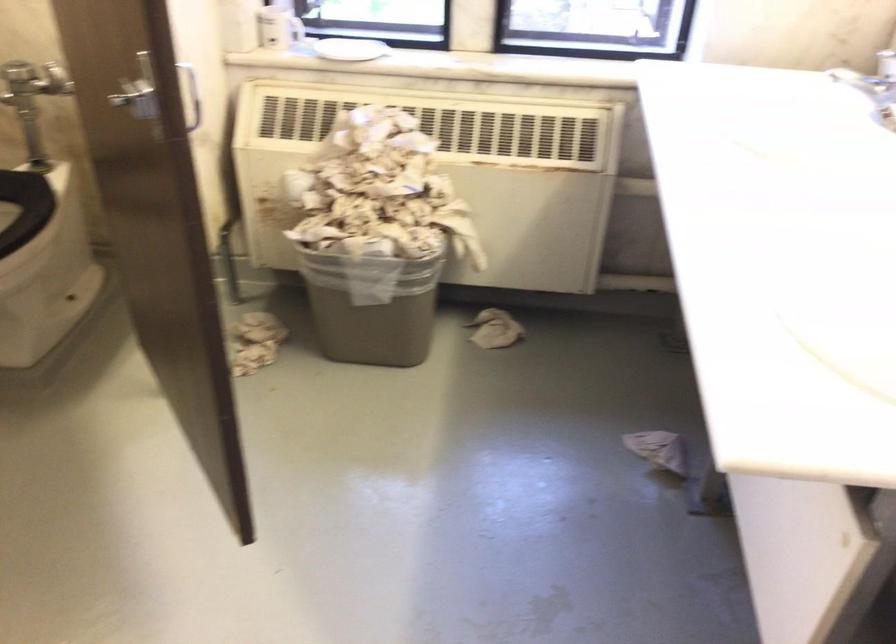
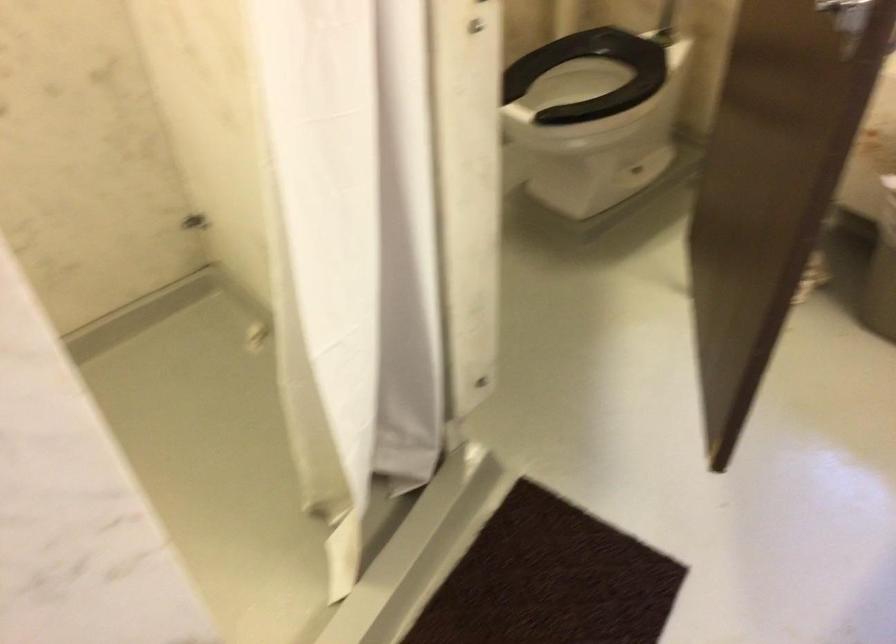
Question: I am providing you with two images of the same scene from different viewpoints. After the viewpoint changes to image2, which objects are now occluded?

Choices:
 (A) metal door handle
 (B) crumpled paper towel
 (C) black toilet seat
 (D) red shoe box

Answer: (B)